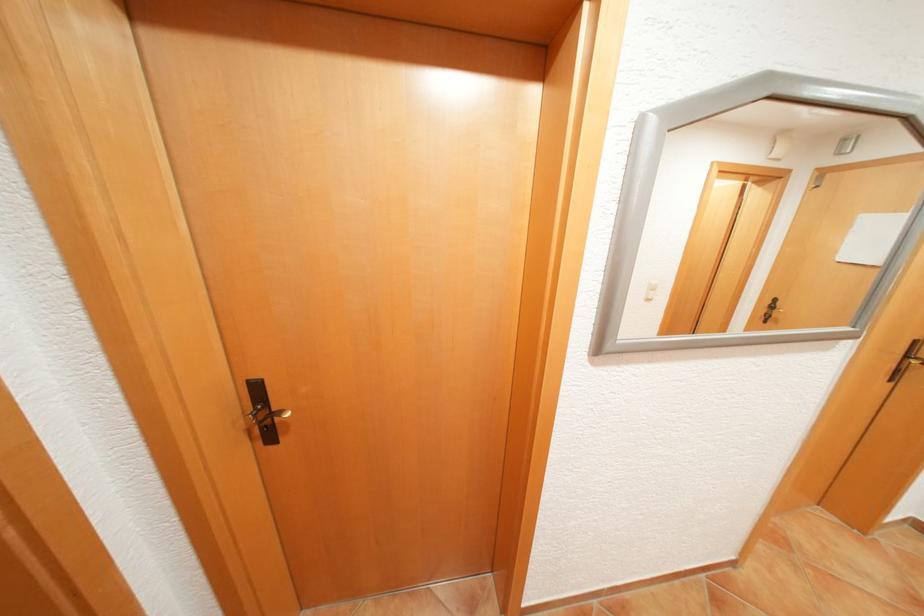
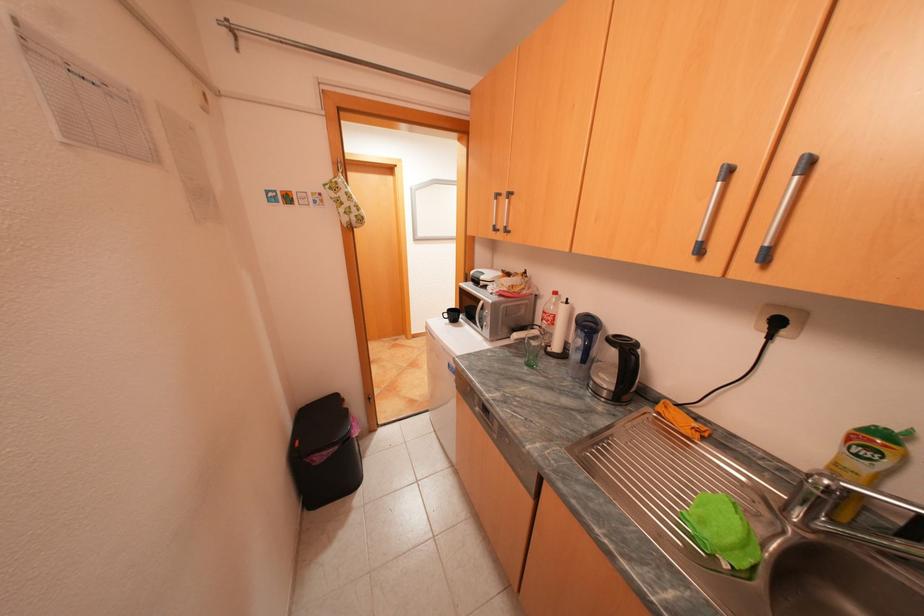
Question: Which direction would the cameraman need to move to produce the second image? Reply with the corresponding letter.

Choices:
 (A) Left
 (B) Right
 (C) Forward
 (D) Backward

Answer: (D)